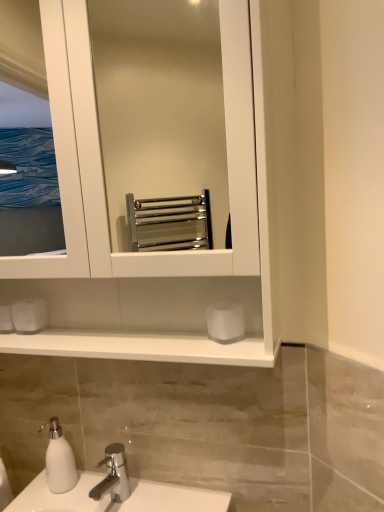
Image resolution: width=384 pixels, height=512 pixels. I want to click on white matte toilet paper at center, positioned as the 1th toilet paper in right-to-left order, so click(x=225, y=322).

Where is `white matte toilet paper at lower left, acting as the second toilet paper starting from the front`? This screenshot has width=384, height=512. white matte toilet paper at lower left, acting as the second toilet paper starting from the front is located at coordinates (30, 315).

Considering the positions of points (62, 432) and (128, 486), is point (62, 432) farther from camera compared to point (128, 486)?

Yes.

Locate an element on the screen. The image size is (384, 512). soap dispenser above the silver metallic tap at lower center (from the image's perspective) is located at coordinates (59, 460).

Is white matte soap dispenser at lower left wider than silver metallic tap at lower center?

No, white matte soap dispenser at lower left is not wider than silver metallic tap at lower center.

How different are the orientations of silver metallic tap at lower center and white matte toilet paper at lower left, placed as the second toilet paper when sorted from right to left, in degrees?

silver metallic tap at lower center and white matte toilet paper at lower left, placed as the second toilet paper when sorted from right to left, are facing 1.19 degrees away from each other.

From a real-world perspective, is silver metallic tap at lower center positioned above or below white matte toilet paper at lower left, the first toilet paper positioned from the left?

silver metallic tap at lower center is below white matte toilet paper at lower left, the first toilet paper positioned from the left.

Is point (122, 467) closer to viewer compared to point (18, 329)?

No, it is not.

Which object is closer to the camera taking this photo, silver metallic tap at lower center or white matte toilet paper at lower left, the first toilet paper from the back?

silver metallic tap at lower center is closer to the camera.

The height and width of the screenshot is (512, 384). I want to click on bathroom cabinet located above the silver metallic tap at lower center (from the image's perspective), so coord(146,252).

From a real-world perspective, is silver metallic tap at lower center positioned above or below white glossy towel rack at center?

silver metallic tap at lower center is situated lower than white glossy towel rack at center in the real world.

Considering the positions of objects silver metallic tap at lower center and white glossy towel rack at center in the image provided, who is more to the left, silver metallic tap at lower center or white glossy towel rack at center?

white glossy towel rack at center.

Considering the relative sizes of white matte toilet paper at lower left, the first toilet paper from the back, and silver metallic tap at lower center in the image provided, is white matte toilet paper at lower left, the first toilet paper from the back, taller than silver metallic tap at lower center?

In fact, white matte toilet paper at lower left, the first toilet paper from the back, may be shorter than silver metallic tap at lower center.

Can you tell me how much white matte toilet paper at lower left, the first toilet paper positioned from the left, and silver metallic tap at lower center differ in facing direction?

They differ by 1.19 degrees in their facing directions.

Is white matte toilet paper at lower left, acting as the second toilet paper starting from the front, positioned with its back to silver metallic tap at lower center?

No.

In the image, is white matte toilet paper at lower left, the first toilet paper from the back, on the left side or the right side of silver metallic tap at lower center?

From the image, it's evident that white matte toilet paper at lower left, the first toilet paper from the back, is to the left of silver metallic tap at lower center.

From a real-world perspective, is white matte toilet paper at lower left, the first toilet paper from the back, positioned over white matte soap dispenser at lower left based on gravity?

Yes.

What are the coordinates of `toilet paper on the left of white matte soap dispenser at lower left` in the screenshot? It's located at (30, 315).

Would you say white matte soap dispenser at lower left is part of white matte toilet paper at lower left, acting as the second toilet paper starting from the front,'s contents?

No, white matte toilet paper at lower left, acting as the second toilet paper starting from the front, does not contain white matte soap dispenser at lower left.

Is white matte toilet paper at lower left, the first toilet paper positioned from the left, wider or thinner than white matte soap dispenser at lower left?

Considering their sizes, white matte toilet paper at lower left, the first toilet paper positioned from the left, looks slimmer than white matte soap dispenser at lower left.

Does point (42, 322) appear closer or farther from the camera than point (129, 262)?

Point (42, 322) is positioned farther from the camera compared to point (129, 262).

Identify the location of toilet paper that is on the left side of white glossy towel rack at center. (30, 315).

Is white matte toilet paper at lower left, acting as the second toilet paper starting from the front, not within white glossy towel rack at center?

Actually, white matte toilet paper at lower left, acting as the second toilet paper starting from the front, is within white glossy towel rack at center.

Is white glossy towel rack at center spatially inside white matte toilet paper at center, the 2th toilet paper positioned from the back, or outside of it?

white glossy towel rack at center is not inside white matte toilet paper at center, the 2th toilet paper positioned from the back, it's outside.

Considering the positions of objects white glossy towel rack at center and white matte toilet paper at center, marked as the 2th toilet paper in a left-to-right arrangement, in the image provided, who is more to the right, white glossy towel rack at center or white matte toilet paper at center, marked as the 2th toilet paper in a left-to-right arrangement,?

white matte toilet paper at center, marked as the 2th toilet paper in a left-to-right arrangement, is more to the right.

From a real-world perspective, is white glossy towel rack at center on top of white matte toilet paper at center, positioned as the 1th toilet paper in right-to-left order?

Correct, in the physical world, white glossy towel rack at center is higher than white matte toilet paper at center, positioned as the 1th toilet paper in right-to-left order.

Identify the location of soap dispenser that appears above the silver metallic tap at lower center (from a real-world perspective). The image size is (384, 512). (59, 460).

Find the location of `tap on the right of white matte toilet paper at lower left, the first toilet paper from the back`. tap on the right of white matte toilet paper at lower left, the first toilet paper from the back is located at coordinates (113, 475).

Looking at this image, estimate the real-world distances between objects in this image. Which object is closer to white matte soap dispenser at lower left, white matte toilet paper at center, the 2th toilet paper positioned from the back, or white matte toilet paper at lower left, the first toilet paper from the back?

The object closer to white matte soap dispenser at lower left is white matte toilet paper at lower left, the first toilet paper from the back.

Looking at the image, which one is located further to white matte toilet paper at center, marked as the first toilet paper in a front-to-back arrangement, white matte toilet paper at lower left, the first toilet paper positioned from the left, or white matte soap dispenser at lower left?

Based on the image, white matte soap dispenser at lower left appears to be further to white matte toilet paper at center, marked as the first toilet paper in a front-to-back arrangement.

Considering their positions, is white matte soap dispenser at lower left positioned further to white glossy towel rack at center than white matte toilet paper at lower left, the first toilet paper positioned from the left?

The object further to white glossy towel rack at center is white matte soap dispenser at lower left.

From the picture: Looking at the image, which one is located further to white matte toilet paper at center, marked as the 2th toilet paper in a left-to-right arrangement, white glossy towel rack at center or silver metallic tap at lower center?

silver metallic tap at lower center lies further to white matte toilet paper at center, marked as the 2th toilet paper in a left-to-right arrangement, than the other object.

Based on their spatial positions, is silver metallic tap at lower center or white glossy towel rack at center closer to white matte toilet paper at center, marked as the 2th toilet paper in a left-to-right arrangement?

Based on the image, white glossy towel rack at center appears to be nearer to white matte toilet paper at center, marked as the 2th toilet paper in a left-to-right arrangement.

Looking at the image, which one is located closer to white matte toilet paper at center, the 2th toilet paper positioned from the back, white matte soap dispenser at lower left or white glossy towel rack at center?

The object closer to white matte toilet paper at center, the 2th toilet paper positioned from the back, is white glossy towel rack at center.

Considering their positions, is white matte toilet paper at center, positioned as the 1th toilet paper in right-to-left order, positioned closer to white matte soap dispenser at lower left than white glossy towel rack at center?

white glossy towel rack at center is closer to white matte soap dispenser at lower left.

From the image, which object appears to be farther from white matte soap dispenser at lower left, silver metallic tap at lower center or white matte toilet paper at center, the 2th toilet paper positioned from the back?

white matte toilet paper at center, the 2th toilet paper positioned from the back, lies further to white matte soap dispenser at lower left than the other object.

Where is `soap dispenser between white matte toilet paper at lower left, placed as the second toilet paper when sorted from right to left, and white matte toilet paper at center, positioned as the 1th toilet paper in right-to-left order, in the horizontal direction`? This screenshot has height=512, width=384. soap dispenser between white matte toilet paper at lower left, placed as the second toilet paper when sorted from right to left, and white matte toilet paper at center, positioned as the 1th toilet paper in right-to-left order, in the horizontal direction is located at coordinates (x=59, y=460).

Locate an element on the screen. soap dispenser between white matte toilet paper at lower left, placed as the second toilet paper when sorted from right to left, and silver metallic tap at lower center from top to bottom is located at coordinates (59, 460).

Locate an element on the screen. The height and width of the screenshot is (512, 384). soap dispenser between white glossy towel rack at center and silver metallic tap at lower center in the vertical direction is located at coordinates (59, 460).

Identify the location of tap between white matte toilet paper at lower left, placed as the second toilet paper when sorted from right to left, and white matte toilet paper at center, positioned as the 1th toilet paper in right-to-left order. The image size is (384, 512). (113, 475).